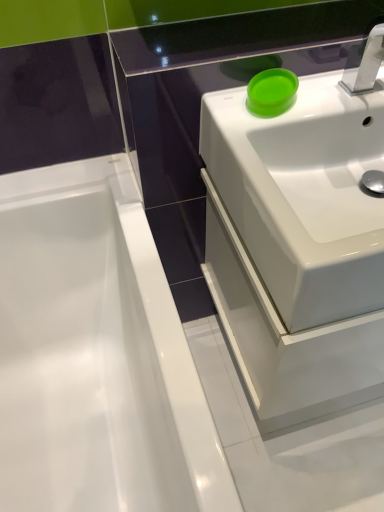
Where is `vacant area that lies between matte green bowl at upper right and silver metallic tap at upper right`? vacant area that lies between matte green bowl at upper right and silver metallic tap at upper right is located at coordinates (323, 98).